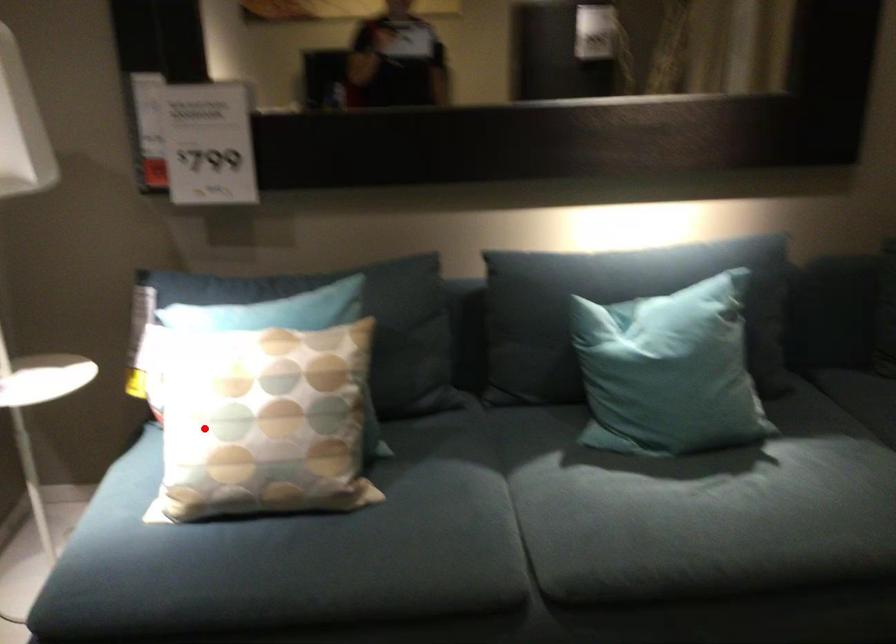
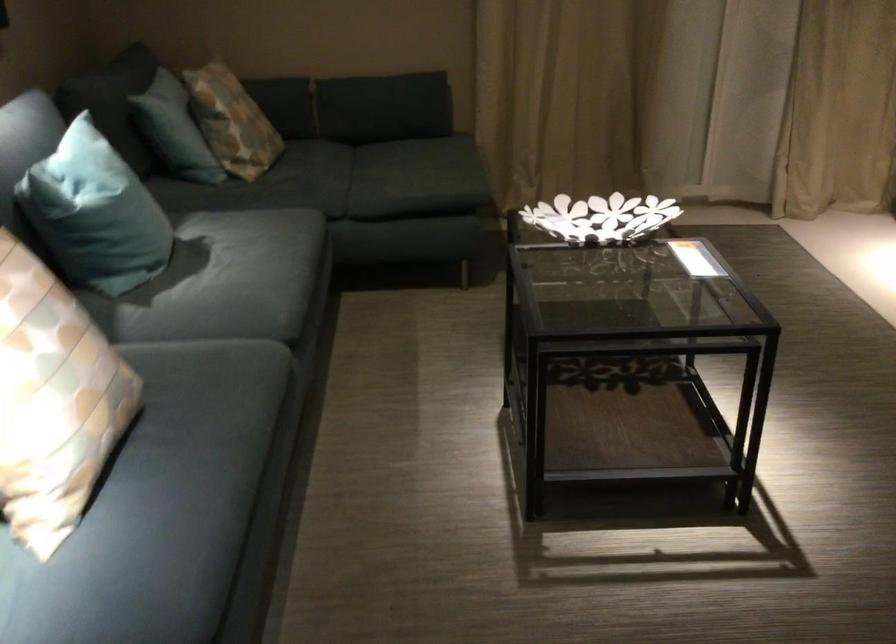
Question: A red point is marked in image1. In image2, is the corresponding 3D point closer to the camera or farther? Reply with the corresponding letter.

Choices:
 (A) The corresponding 3D point is closer.
 (B) The corresponding 3D point is farther.

Answer: (A)